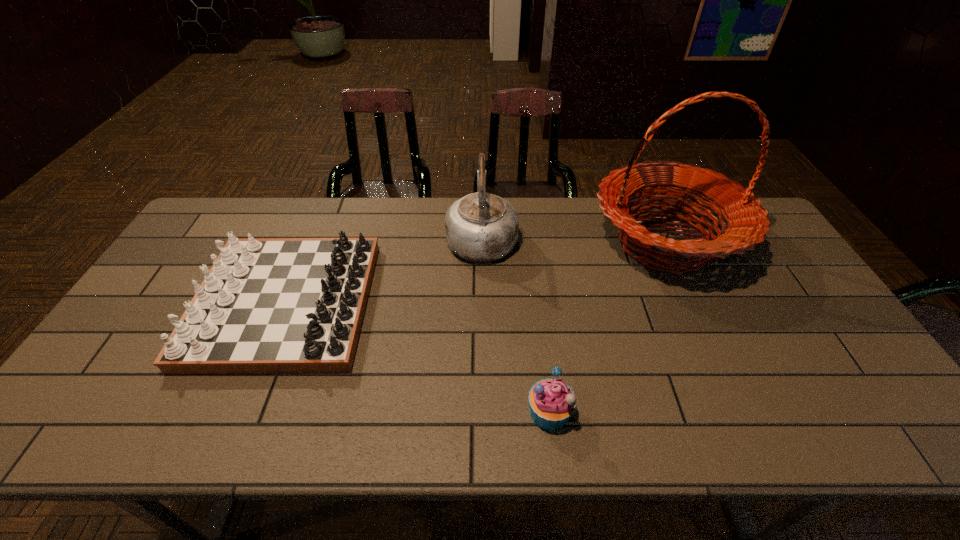
This screenshot has height=540, width=960. I want to click on kettle that is positioned at the far edge, so click(480, 227).

You are a GUI agent. You are given a task and a screenshot of the screen. Output one action in this format:
    pyautogui.click(x=<x>, y=<y>)
    Task: Click on the object that is at the near edge
    
    Given the screenshot: What is the action you would take?
    pyautogui.click(x=552, y=402)

Find the location of `object at the right edge`. object at the right edge is located at coordinates (746, 222).

Where is `object that is positioned at the far right corner`? The image size is (960, 540). object that is positioned at the far right corner is located at coordinates (746, 222).

Where is `vacant space at the far edge of the desktop`? The height and width of the screenshot is (540, 960). vacant space at the far edge of the desktop is located at coordinates (300, 211).

Where is `vacant space at the near edge of the desktop`? vacant space at the near edge of the desktop is located at coordinates (167, 418).

Identify the location of free point at the left edge. (214, 243).

Identify the location of free space at the right edge of the desktop. (768, 272).

Where is `free location at the far left corner of the desktop`? The image size is (960, 540). free location at the far left corner of the desktop is located at coordinates (240, 208).

I want to click on free region at the near left corner, so click(90, 420).